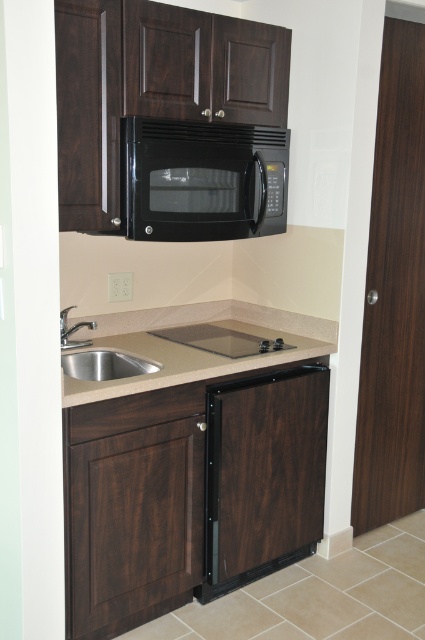
Question: Can you confirm if black matte microwave at upper center is positioned below beige laminate countertop at lower center?

Choices:
 (A) yes
 (B) no

Answer: (B)

Question: Is black matte microwave at upper center further to the viewer compared to beige laminate countertop at lower center?

Choices:
 (A) no
 (B) yes

Answer: (B)

Question: Among these points, which one is nearest to the camera?

Choices:
 (A) (206, 328)
 (B) (142, 362)

Answer: (B)

Question: Does beige laminate countertop at lower center appear over stainless steel sink at lower left?

Choices:
 (A) yes
 (B) no

Answer: (A)

Question: Considering the real-world distances, which object is farthest from the black matte microwave at upper center?

Choices:
 (A) stainless steel sink at lower left
 (B) beige laminate countertop at lower center

Answer: (A)

Question: Which of the following is the closest to the observer?

Choices:
 (A) (308, 333)
 (B) (292, 348)
 (C) (212, 224)
 (D) (67, 307)

Answer: (C)